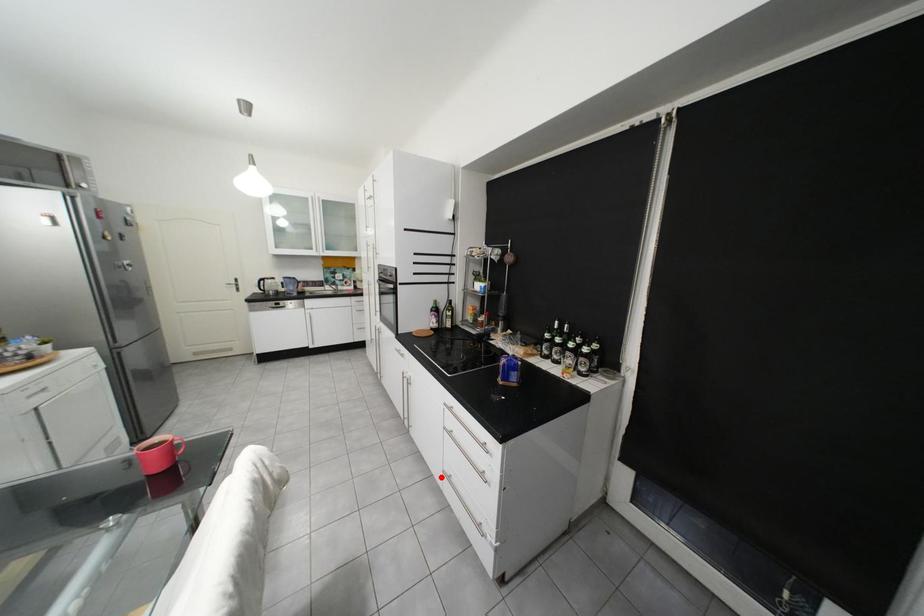
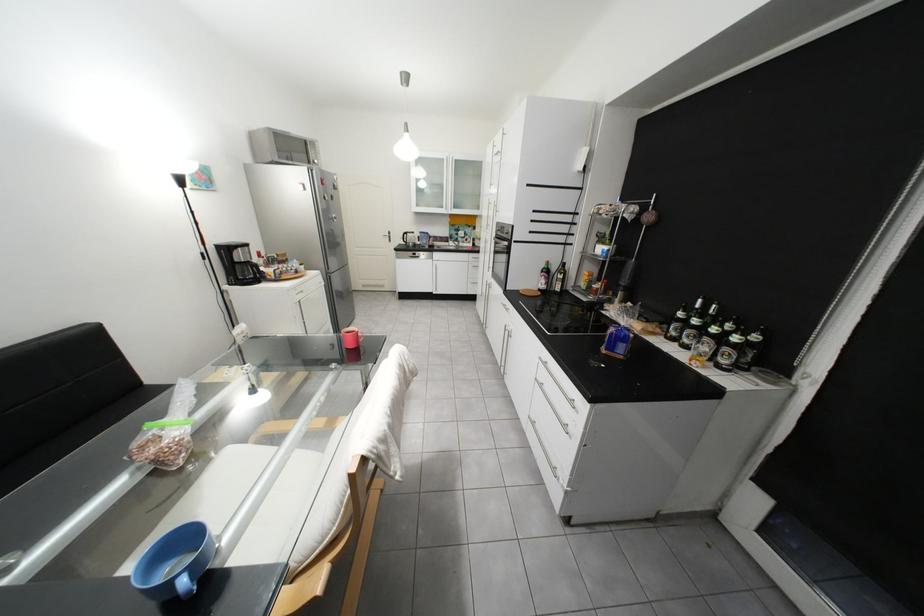
Question: I am providing you with two images of the same scene from different viewpoints. A red point is shown in image1. For the corresponding object point in image2, is it positioned nearer or farther from the camera?

Choices:
 (A) Nearer
 (B) Farther

Answer: (A)